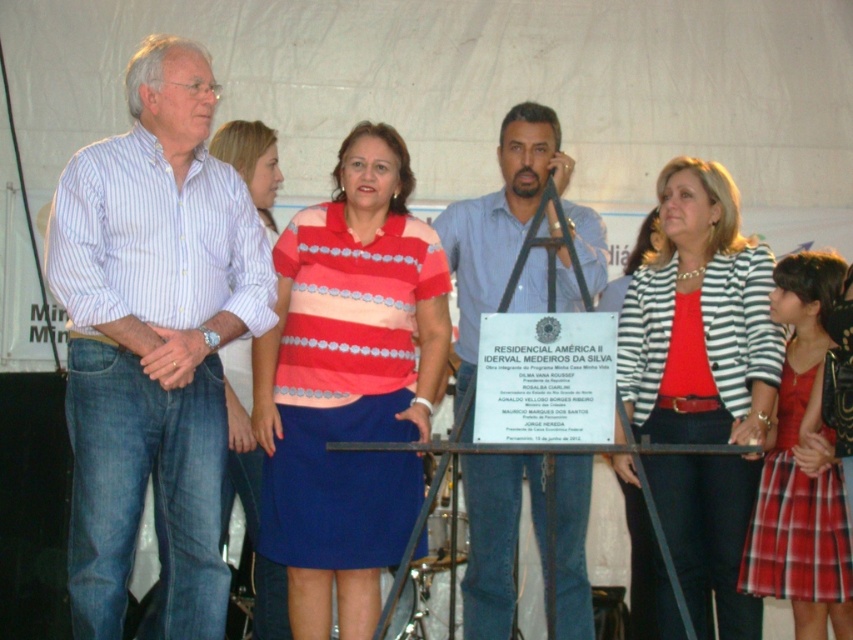
Question: Does white striped shirt at left appear under striped fabric jacket at center?

Choices:
 (A) no
 (B) yes

Answer: (A)

Question: Which object is the farthest from the striped cotton jacket at center?

Choices:
 (A) white striped shirt at left
 (B) light blue striped shirt at left

Answer: (A)

Question: In this image, where is striped cotton shirt at center located relative to striped fabric jacket at center?

Choices:
 (A) right
 (B) left

Answer: (B)

Question: Which point is closer to the camera?

Choices:
 (A) light blue striped shirt at left
 (B) plaid fabric dress at lower right
 (C) striped cotton shirt at center

Answer: (A)

Question: Is light blue striped shirt at left positioned behind striped cotton jacket at center?

Choices:
 (A) no
 (B) yes

Answer: (A)

Question: Which of the following is the closest to the observer?

Choices:
 (A) (595, 244)
 (B) (695, 428)
 (C) (811, 262)
 (D) (183, 410)

Answer: (D)